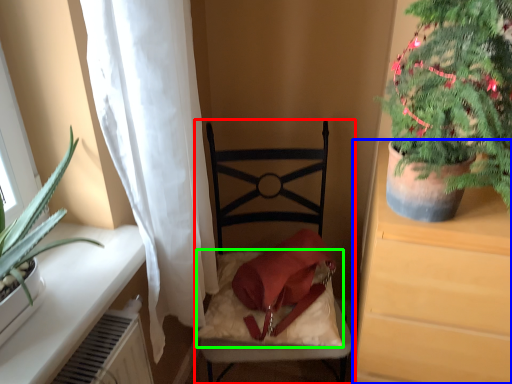
Question: Which is farther away from chair (highlighted by a red box)? cabinetry (highlighted by a blue box) or pillow (highlighted by a green box)?

Choices:
 (A) cabinetry
 (B) pillow

Answer: (A)